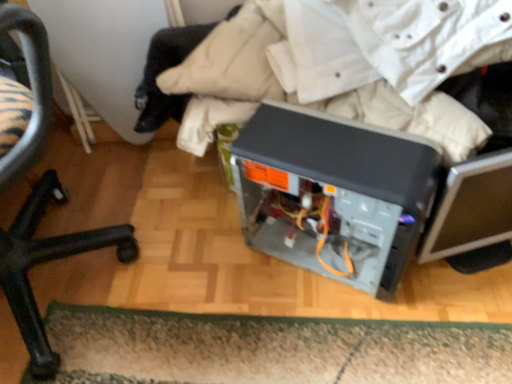
At what (x,y) coordinates should I click in order to perform the action: click on vacant area on the back side of green shaggy doormat at lower center. Please return your answer as a coordinate pair (x, y). This screenshot has height=384, width=512. Looking at the image, I should click on (206, 236).